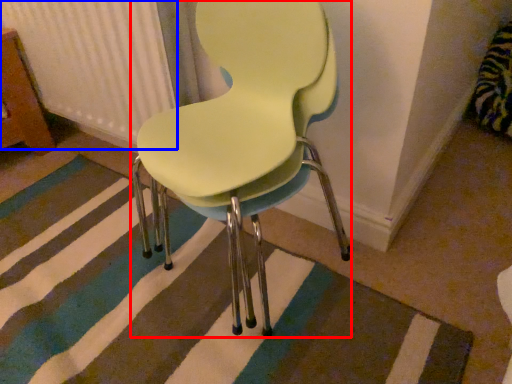
Question: Which object is further to the camera taking this photo, chair (highlighted by a red box) or radiator (highlighted by a blue box)?

Choices:
 (A) chair
 (B) radiator

Answer: (B)